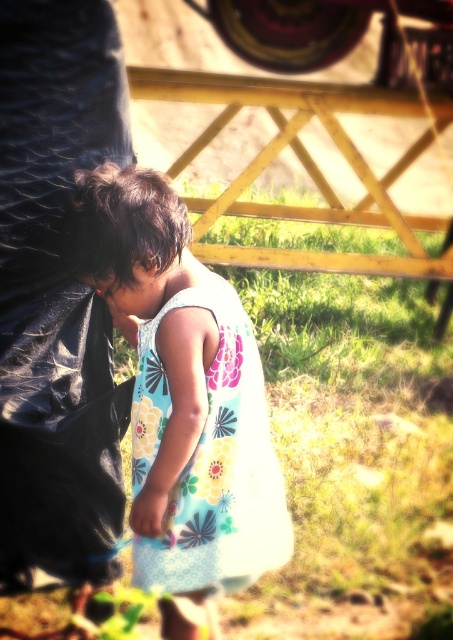
You are a tailor comparing two dresses in the image. The floral fabric dress at center and the floral cotton dress at center are both in front of you. Which dress is wider?

The floral fabric dress at center is wider than the floral cotton dress at center according to the description.